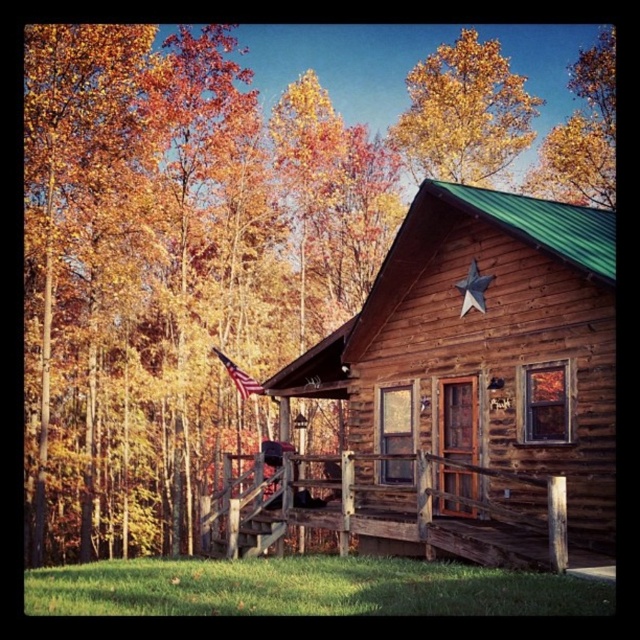
Is rustic wood cabin at center closer to camera compared to american flag at center?

Yes, rustic wood cabin at center is closer to the viewer.

Where is `rustic wood cabin at center`? The width and height of the screenshot is (640, 640). rustic wood cabin at center is located at coordinates (480, 384).

The height and width of the screenshot is (640, 640). Describe the element at coordinates (464, 113) in the screenshot. I see `golden yellow leaves at upper center` at that location.

Does golden yellow leaves at upper center appear under american flag at center?

Incorrect, golden yellow leaves at upper center is not positioned below american flag at center.

Does point (506, 131) come in front of point (253, 381)?

That is False.

Where is `golden yellow leaves at upper center`? golden yellow leaves at upper center is located at coordinates tap(464, 113).

Which is behind, point (515, 490) or point (420, 132)?

The point (420, 132) is more distant.

You are a GUI agent. You are given a task and a screenshot of the screen. Output one action in this format:
    pyautogui.click(x=<x>, y=<y>)
    Task: Click on the rustic wood cabin at center
    The image size is (640, 640).
    Given the screenshot: What is the action you would take?
    pyautogui.click(x=480, y=384)

Is point (497, 221) positioned after point (472, 156)?

No.

Identify the location of rustic wood cabin at center. (480, 384).